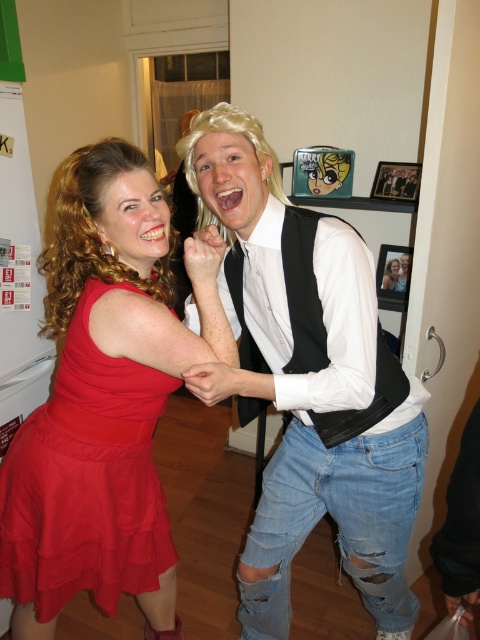
You are standing in the room and want to place a small decorative item exactly at the point marked as point (308,381). What object will the item be placed on?

The small decorative item will be placed on the white matte vest at center located at point (308,381).